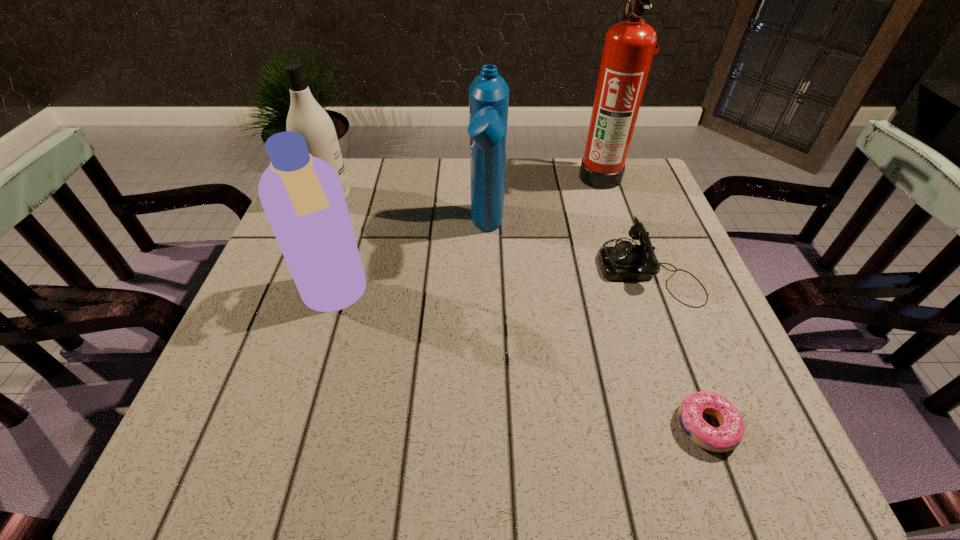
The width and height of the screenshot is (960, 540). What are the coordinates of `vacant region located 0.170m on the right of the nearest shampoo` in the screenshot? It's located at (451, 297).

This screenshot has width=960, height=540. In order to click on free spot located on the front-facing side of the telephone in this screenshot , I will do `click(430, 269)`.

Find the location of a particular element. Image resolution: width=960 pixels, height=540 pixels. vacant region located on the front-facing side of the telephone is located at coordinates (513, 269).

At what (x,y) coordinates should I click in order to perform the action: click on blank space located on the front-facing side of the telephone. Please return your answer as a coordinate pair (x, y). The height and width of the screenshot is (540, 960). Looking at the image, I should click on (416, 269).

The image size is (960, 540). Identify the location of vacant area situated on the left of the nearest object. (608, 426).

The width and height of the screenshot is (960, 540). I want to click on fire extinguisher that is at the far edge, so click(629, 46).

What are the coordinates of `object that is at the near edge` in the screenshot? It's located at (728, 436).

Locate an element on the screen. fire extinguisher located at the right edge is located at coordinates 629,46.

The width and height of the screenshot is (960, 540). I want to click on telephone at the right edge, so click(x=625, y=261).

Where is `doughnut that is at the right edge`? This screenshot has width=960, height=540. doughnut that is at the right edge is located at coordinates (728, 436).